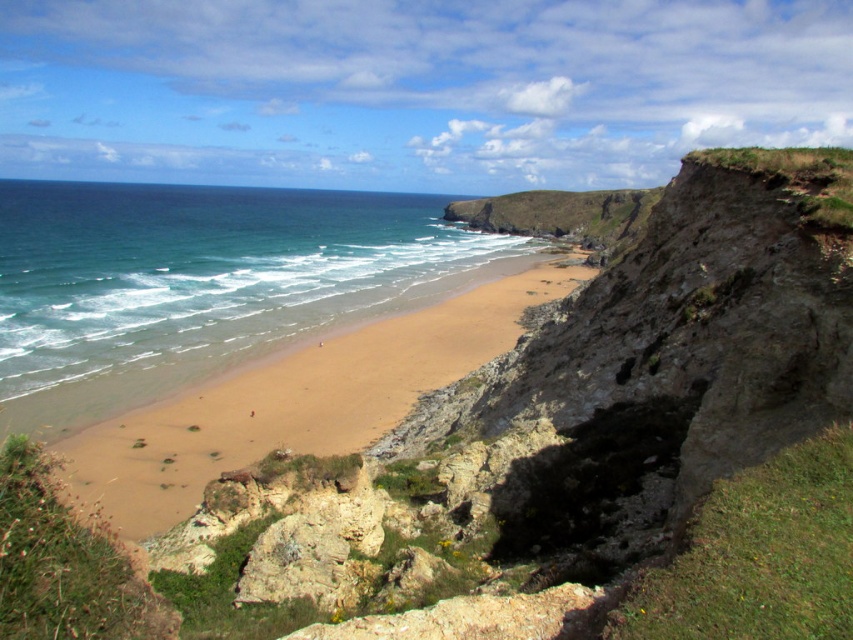
You are standing on the cliff and looking out at the coastal scene. You see the blue water at center and the brown sandy beach at center. Which one is positioned to the left?

The blue water at center is positioned to the left of the brown sandy beach at center.

You are standing on the brown sandy beach at center and want to reach the blue water at center. Based on the scene description, which direction should you walk to get to the water?

The blue water at center is larger in size than the brown sandy beach at center, so you should walk towards the center of the image where the larger blue water is located.

You are standing on the beach in the coastal scene. You see a point marked at coordinates [200,282]. What is located at that point?

The point at coordinates [200,282] marks blue water at center.